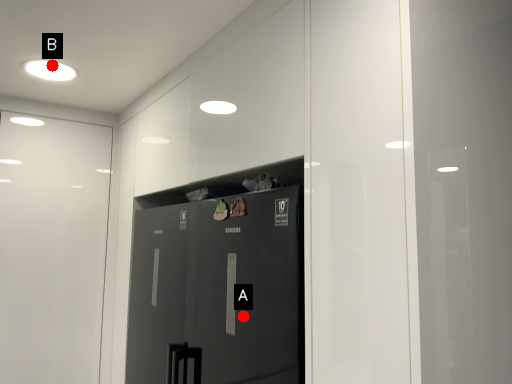
Question: Two points are circled on the image, labeled by A and B beside each circle. Among these points, which one is nearest to the camera?

Choices:
 (A) A is closer
 (B) B is closer

Answer: (A)